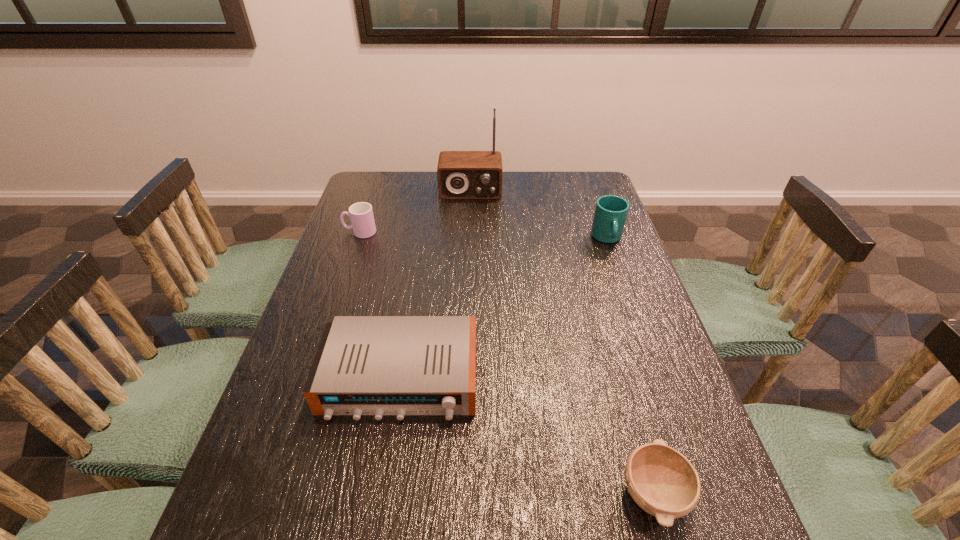
Locate an element on the screen. The height and width of the screenshot is (540, 960). free space located on the control panel of the shorter radio receiver is located at coordinates (376, 529).

I want to click on vacant position located on the back of the nearest object, so click(623, 385).

At what (x,y) coordinates should I click in order to perform the action: click on object present at the far edge. Please return your answer as a coordinate pair (x, y). Looking at the image, I should click on (461, 174).

You are a GUI agent. You are given a task and a screenshot of the screen. Output one action in this format:
    pyautogui.click(x=<x>, y=<y>)
    Task: Click on the object that is positioned at the near edge
    This screenshot has width=960, height=540.
    Given the screenshot: What is the action you would take?
    pyautogui.click(x=662, y=481)

Identify the location of cup at the left edge. This screenshot has width=960, height=540. (361, 214).

Identify the location of radio receiver situated at the left edge. (365, 365).

Where is `cup at the right edge`? cup at the right edge is located at coordinates (611, 211).

You are a GUI agent. You are given a task and a screenshot of the screen. Output one action in this format:
    pyautogui.click(x=<x>, y=<y>)
    Task: Click on the bowl that is at the right edge
    This screenshot has height=540, width=960.
    Given the screenshot: What is the action you would take?
    pyautogui.click(x=662, y=481)

Where is `object located at the near right corner`? object located at the near right corner is located at coordinates click(x=662, y=481).

The width and height of the screenshot is (960, 540). I want to click on vacant space at the left edge of the desktop, so click(274, 445).